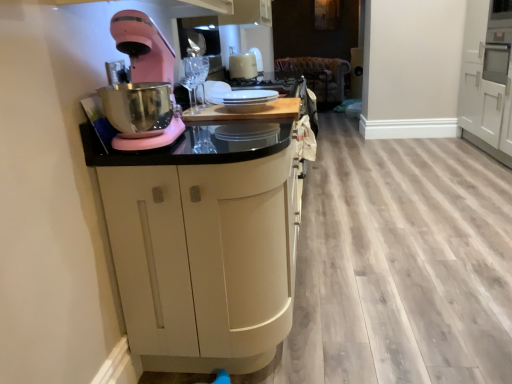
Question: Is matte black cabinet at center, which is the second cabinetry in back-to-front order, oriented towards white glossy plates at center?

Choices:
 (A) yes
 (B) no

Answer: (B)

Question: Is matte black cabinet at center, which is the 1th cabinetry in left-to-right order, in contact with white glossy plates at center?

Choices:
 (A) yes
 (B) no

Answer: (B)

Question: Is matte black cabinet at center, the 1th cabinetry when ordered from front to back, not within white glossy plates at center?

Choices:
 (A) yes
 (B) no

Answer: (A)

Question: Is white glossy plates at center surrounded by matte black cabinet at center, the second cabinetry positioned from the right?

Choices:
 (A) no
 (B) yes

Answer: (B)

Question: From a real-world perspective, is matte black cabinet at center, the second cabinetry positioned from the right, on white glossy plates at center?

Choices:
 (A) no
 (B) yes

Answer: (A)

Question: Looking at their shapes, would you say matte black cabinet at center, which is the second cabinetry in back-to-front order, is wider or thinner than white glossy kettle at upper center?

Choices:
 (A) wide
 (B) thin

Answer: (A)

Question: In terms of height, does matte black cabinet at center, the second cabinetry positioned from the right, look taller or shorter compared to white glossy kettle at upper center?

Choices:
 (A) tall
 (B) short

Answer: (A)

Question: From the image's perspective, relative to white glossy kettle at upper center, is matte black cabinet at center, which is the 1th cabinetry in left-to-right order, above or below?

Choices:
 (A) below
 (B) above

Answer: (A)

Question: Does point (274, 248) appear closer or farther from the camera than point (245, 71)?

Choices:
 (A) farther
 (B) closer

Answer: (B)

Question: Looking at the image, does white glossy plates at center seem bigger or smaller compared to pink matte stand mixer at left?

Choices:
 (A) small
 (B) big

Answer: (A)

Question: Considering the positions of white glossy plates at center and pink matte stand mixer at left in the image, is white glossy plates at center wider or thinner than pink matte stand mixer at left?

Choices:
 (A) wide
 (B) thin

Answer: (B)

Question: From a real-world perspective, is white glossy plates at center physically located above or below pink matte stand mixer at left?

Choices:
 (A) below
 (B) above

Answer: (A)

Question: Relative to pink matte stand mixer at left, is white glossy plates at center in front or behind?

Choices:
 (A) front
 (B) behind

Answer: (B)

Question: Looking at their shapes, would you say white glossy kettle at upper center is wider or thinner than pink matte stand mixer at left?

Choices:
 (A) wide
 (B) thin

Answer: (B)

Question: Is point (249, 77) positioned closer to the camera than point (140, 79)?

Choices:
 (A) farther
 (B) closer

Answer: (A)